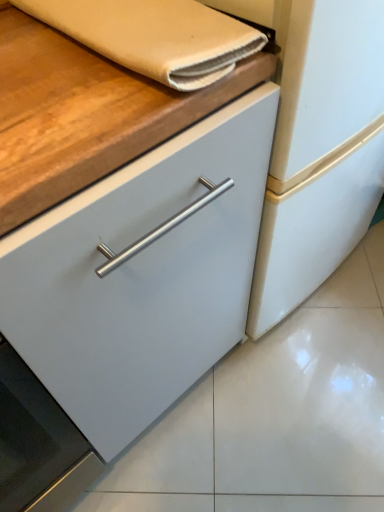
Question: In terms of size, does beige fabric hand towel at upper left appear bigger or smaller than black glass oven at lower left?

Choices:
 (A) big
 (B) small

Answer: (B)

Question: From a real-world perspective, is beige fabric hand towel at upper left physically located above or below black glass oven at lower left?

Choices:
 (A) below
 (B) above

Answer: (B)

Question: In terms of width, does beige fabric hand towel at upper left look wider or thinner when compared to black glass oven at lower left?

Choices:
 (A) wide
 (B) thin

Answer: (B)

Question: From a real-world perspective, is black glass oven at lower left above or below beige fabric hand towel at upper left?

Choices:
 (A) below
 (B) above

Answer: (A)

Question: Is point (36, 416) positioned closer to the camera than point (198, 11)?

Choices:
 (A) farther
 (B) closer

Answer: (A)

Question: Looking at the image, does black glass oven at lower left seem bigger or smaller compared to beige fabric hand towel at upper left?

Choices:
 (A) big
 (B) small

Answer: (A)

Question: Considering the relative positions of black glass oven at lower left and beige fabric hand towel at upper left in the image provided, is black glass oven at lower left to the left or to the right of beige fabric hand towel at upper left?

Choices:
 (A) left
 (B) right

Answer: (A)